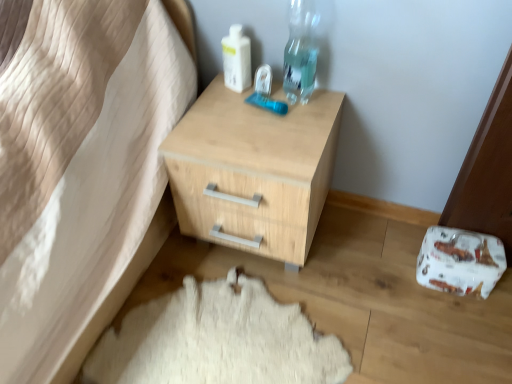
Locate an element on the screen. The image size is (512, 384). vacant space that is to the left of transparent plastic bottle at upper right is located at coordinates (234, 107).